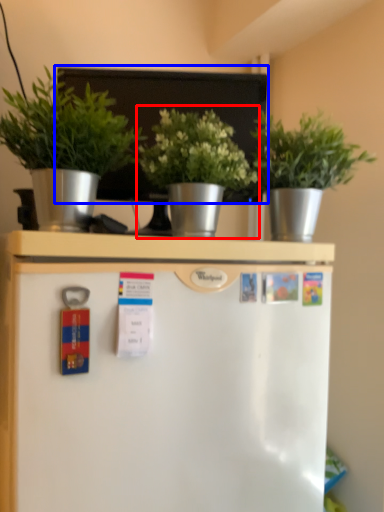
Question: Which of the following is the closest to the observer, houseplant (highlighted by a red box) or bulletin board (highlighted by a blue box)?

Choices:
 (A) houseplant
 (B) bulletin board

Answer: (A)